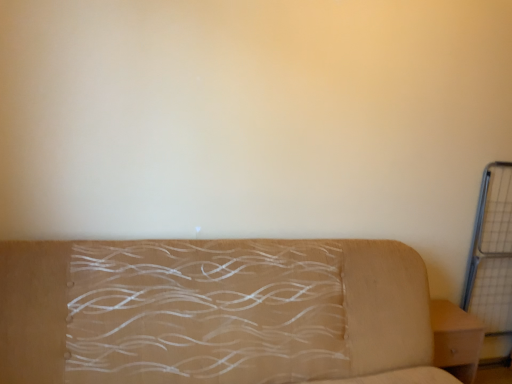
Question: Does light brown wood nightstand at lower right have a larger size compared to metal grid at right?

Choices:
 (A) yes
 (B) no

Answer: (B)

Question: Does light brown wood nightstand at lower right have a greater height compared to metal grid at right?

Choices:
 (A) no
 (B) yes

Answer: (A)

Question: From the image's perspective, is light brown wood nightstand at lower right located beneath metal grid at right?

Choices:
 (A) no
 (B) yes

Answer: (B)

Question: From a real-world perspective, is light brown wood nightstand at lower right over metal grid at right?

Choices:
 (A) no
 (B) yes

Answer: (A)

Question: Does light brown wood nightstand at lower right have a smaller size compared to metal grid at right?

Choices:
 (A) no
 (B) yes

Answer: (B)

Question: Considering the relative sizes of light brown wood nightstand at lower right and metal grid at right in the image provided, is light brown wood nightstand at lower right thinner than metal grid at right?

Choices:
 (A) yes
 (B) no

Answer: (B)

Question: Is metal grid at right in contact with light brown wood nightstand at lower right?

Choices:
 (A) yes
 (B) no

Answer: (B)

Question: Is metal grid at right shorter than light brown wood nightstand at lower right?

Choices:
 (A) no
 (B) yes

Answer: (A)

Question: Is metal grid at right turned away from light brown wood nightstand at lower right?

Choices:
 (A) yes
 (B) no

Answer: (B)

Question: From the image's perspective, is metal grid at right under light brown wood nightstand at lower right?

Choices:
 (A) no
 (B) yes

Answer: (A)

Question: Can light brown wood nightstand at lower right be found inside metal grid at right?

Choices:
 (A) yes
 (B) no

Answer: (B)

Question: Is metal grid at right at the left side of light brown wood nightstand at lower right?

Choices:
 (A) yes
 (B) no

Answer: (B)

Question: Is beige fabric couch at center to the right of metal grid at right from the viewer's perspective?

Choices:
 (A) no
 (B) yes

Answer: (A)